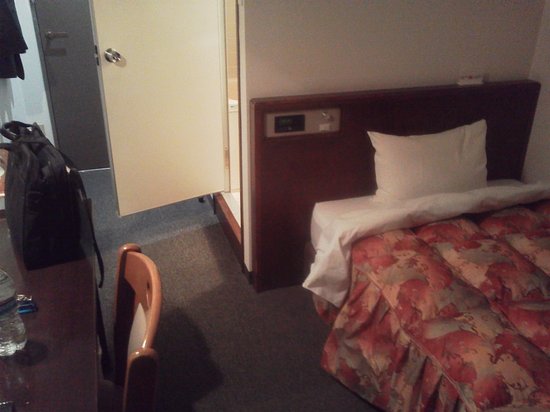
Locate an element on the screen. door handle is located at coordinates (57, 35).